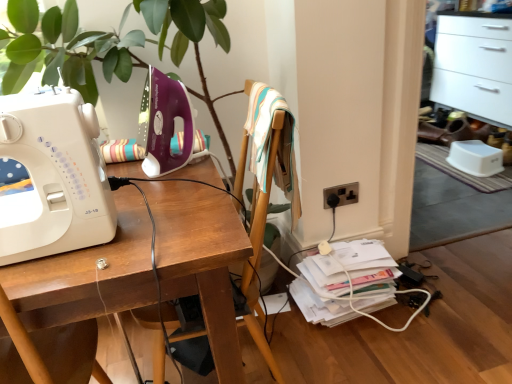
Question: Considering the positions of purple plastic sewing machine at upper left, placed as the second sewing machine when sorted from front to back, and white plastic sewing machine at left, the 2th sewing machine viewed from the back, in the image, is purple plastic sewing machine at upper left, placed as the second sewing machine when sorted from front to back, taller or shorter than white plastic sewing machine at left, the 2th sewing machine viewed from the back,?

Choices:
 (A) tall
 (B) short

Answer: (B)

Question: From the image's perspective, is purple plastic sewing machine at upper left, the 1th sewing machine when ordered from back to front, located above or below white plastic sewing machine at left, the first sewing machine positioned from the front?

Choices:
 (A) above
 (B) below

Answer: (A)

Question: Which object is positioned closest to the wooden desk at center?

Choices:
 (A) white plastic sewing machine at left, the first sewing machine positioned from the front
 (B) wooden chair at center
 (C) purple plastic sewing machine at upper left, the 1th sewing machine when ordered from back to front
 (D) white glossy file cabinet at upper right
 (E) black plastic electric outlet at lower right

Answer: (A)

Question: Which is nearer to the white glossy file cabinet at upper right?

Choices:
 (A) purple plastic sewing machine at upper left, placed as the second sewing machine when sorted from front to back
 (B) white plastic sewing machine at left, the 2th sewing machine viewed from the back
 (C) wooden chair at center
 (D) black plastic electric outlet at lower right
 (E) wooden desk at center

Answer: (D)